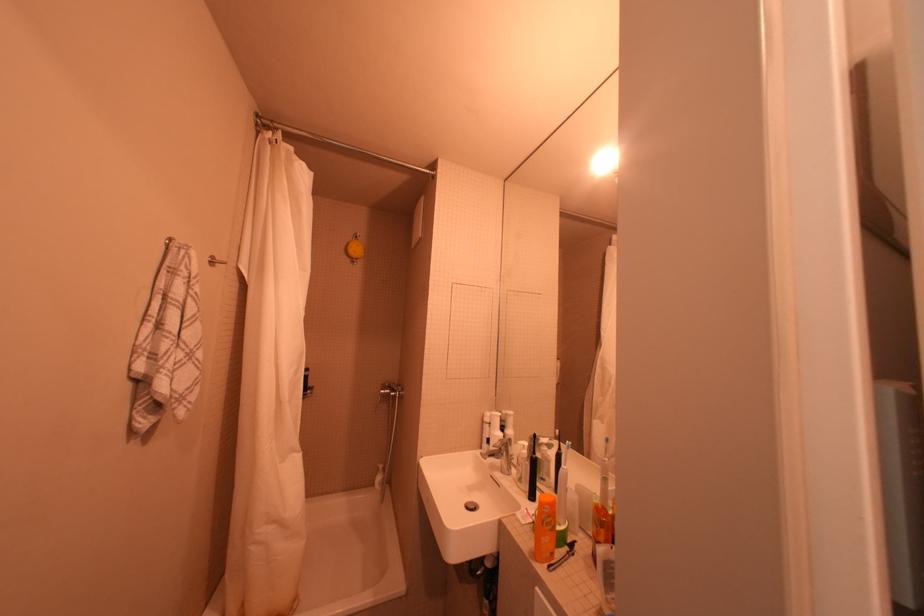
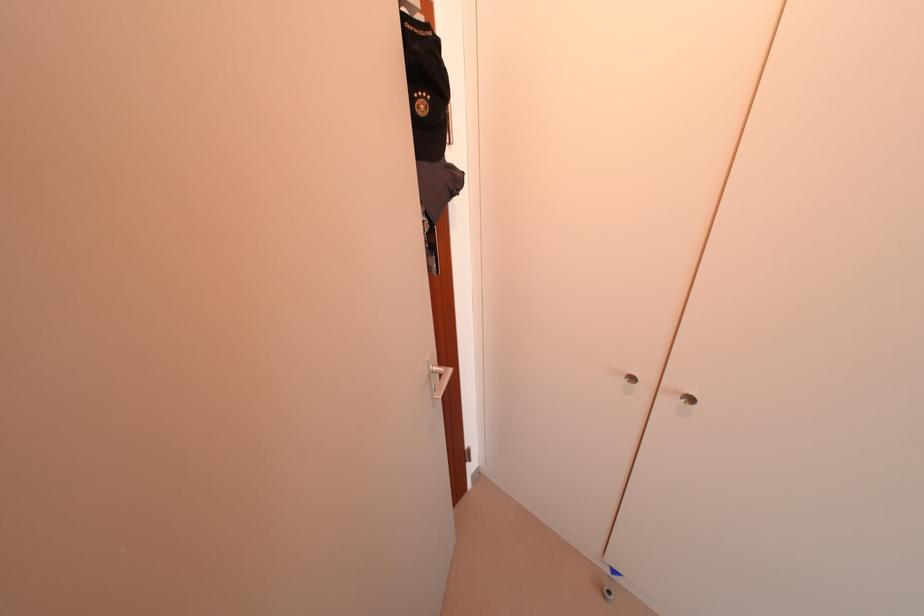
Looking at this image, based on the continuous images, in which direction is the camera rotating?

The rotation direction of the camera is right-down.